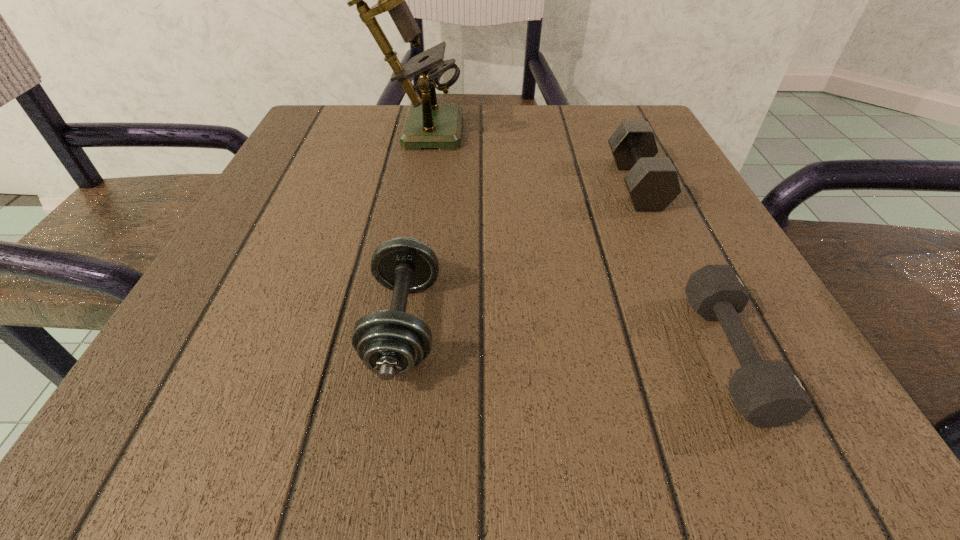
In the image, there is a desktop. Identify the location of vacant area at the far right corner. (641, 116).

Locate an element on the screen. The width and height of the screenshot is (960, 540). vacant space that is in between the shortest dumbbell and the microscope is located at coordinates (571, 240).

What are the coordinates of `vacant area between the leftmost dumbbell and the farthest dumbbell` in the screenshot? It's located at (520, 254).

Locate an element on the screen. The width and height of the screenshot is (960, 540). free space between the farthest object and the shortest dumbbell is located at coordinates (571, 240).

Locate an element on the screen. free space between the leftmost dumbbell and the third nearest object is located at coordinates (520, 254).

Find the location of a particular element. This screenshot has width=960, height=540. empty space between the leftmost dumbbell and the farthest dumbbell is located at coordinates (520, 254).

Locate an element on the screen. This screenshot has height=540, width=960. free space between the shortest dumbbell and the farthest dumbbell is located at coordinates (683, 269).

This screenshot has height=540, width=960. In order to click on free point between the shortest object and the tallest object in this screenshot , I will do `click(571, 240)`.

At what (x,y) coordinates should I click in order to perform the action: click on free space that is in between the second farthest object and the leftmost dumbbell. Please return your answer as a coordinate pair (x, y). Image resolution: width=960 pixels, height=540 pixels. Looking at the image, I should click on (520, 254).

The width and height of the screenshot is (960, 540). What are the coordinates of `free spot between the microscope and the leftmost dumbbell` in the screenshot? It's located at pyautogui.click(x=409, y=225).